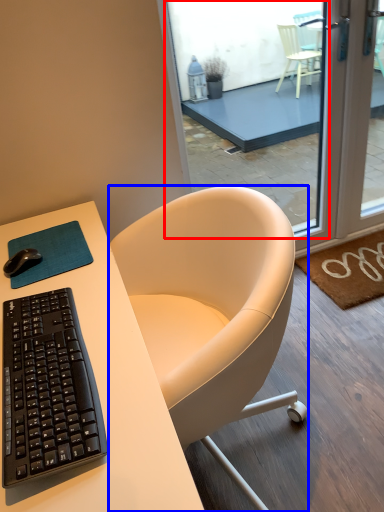
Question: Which object appears farthest to the camera in this image, window (highlighted by a red box) or chair (highlighted by a blue box)?

Choices:
 (A) window
 (B) chair

Answer: (A)